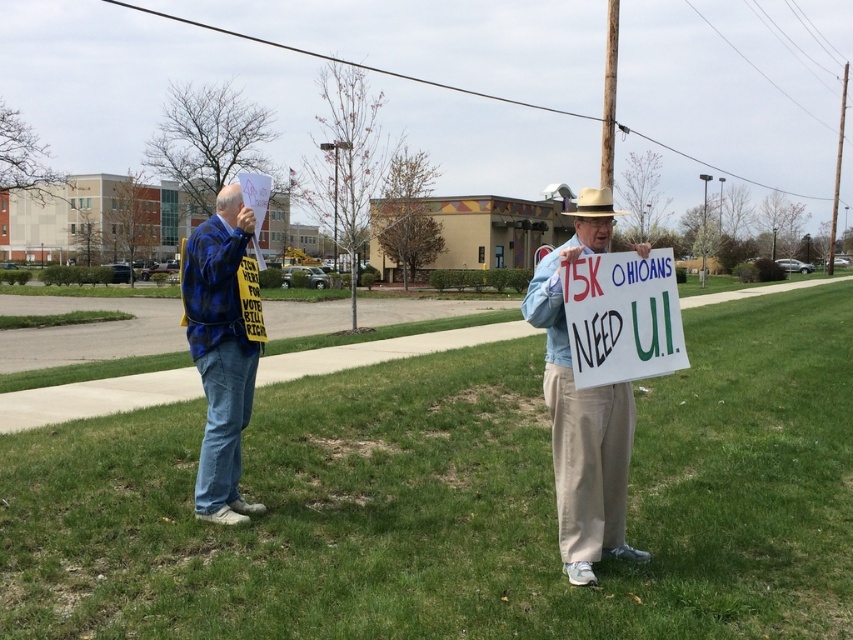
You are a photographer trying to capture a photo of the denim jacket at center and the blue plaid shirt at left. Which object should you focus on first if you want to ensure both are in frame without moving the camera?

The denim jacket at center has a lesser height compared to the blue plaid shirt at left, so you should focus on the taller blue plaid shirt at left first to ensure both are in frame without moving the camera.